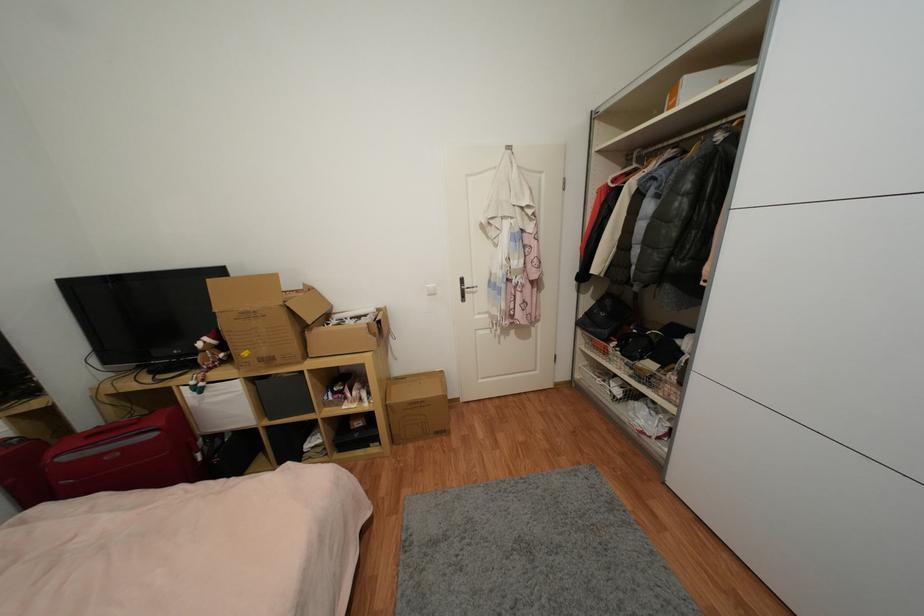
Find the location of a particular element. Image resolution: width=924 pixels, height=616 pixels. white fabric bin is located at coordinates (219, 407).